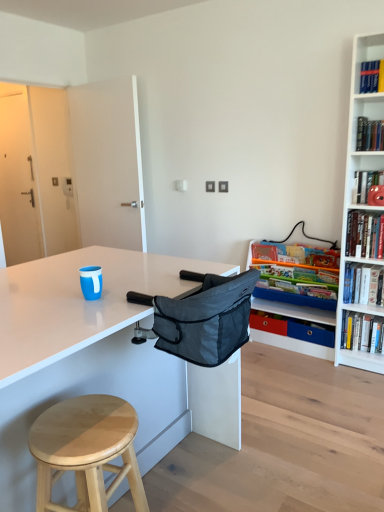
Where is `free spot above hardcover book at right, placed as the third book when sorted from bottom to top (from a real-world perspective)`? The image size is (384, 512). free spot above hardcover book at right, placed as the third book when sorted from bottom to top (from a real-world perspective) is located at coordinates (289, 258).